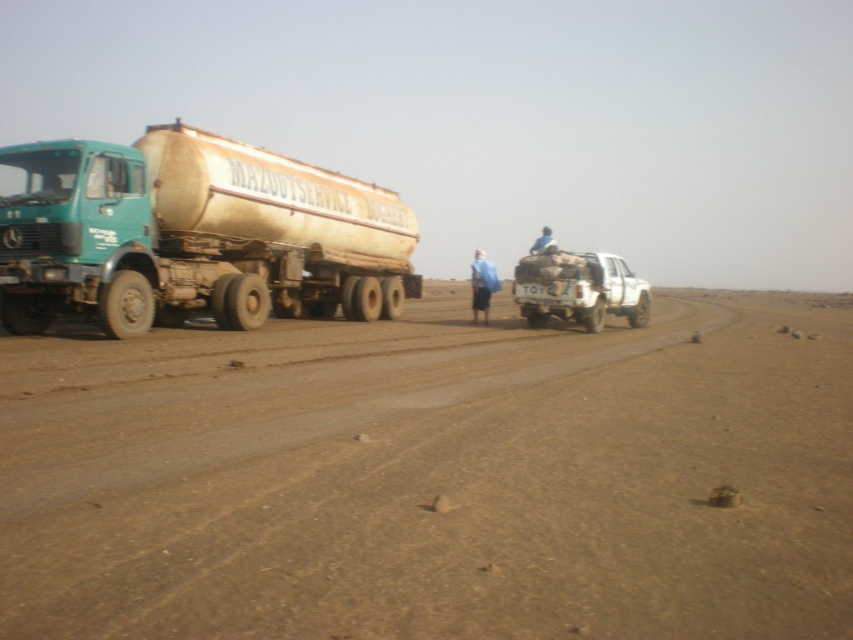
Can you confirm if brown sandy dirt at center is thinner than blue fabric at center?

In fact, brown sandy dirt at center might be wider than blue fabric at center.

Is point (602, 412) closer to viewer compared to point (529, 253)?

Yes.

Identify the location of brown sandy dirt at center. The height and width of the screenshot is (640, 853). (433, 477).

What do you see at coordinates (433, 477) in the screenshot? The width and height of the screenshot is (853, 640). I see `brown sandy dirt at center` at bounding box center [433, 477].

Between brown sandy dirt at center and white matte truck at center, which one is positioned higher?

white matte truck at center is higher up.

Between point (192, 392) and point (636, 282), which one is positioned in front?

Positioned in front is point (192, 392).

Locate an element on the screen. The image size is (853, 640). brown sandy dirt at center is located at coordinates (433, 477).

Is rusty metallic tanker at left below white matte truck at center?

Incorrect, rusty metallic tanker at left is not positioned below white matte truck at center.

This screenshot has height=640, width=853. I want to click on rusty metallic tanker at left, so click(194, 236).